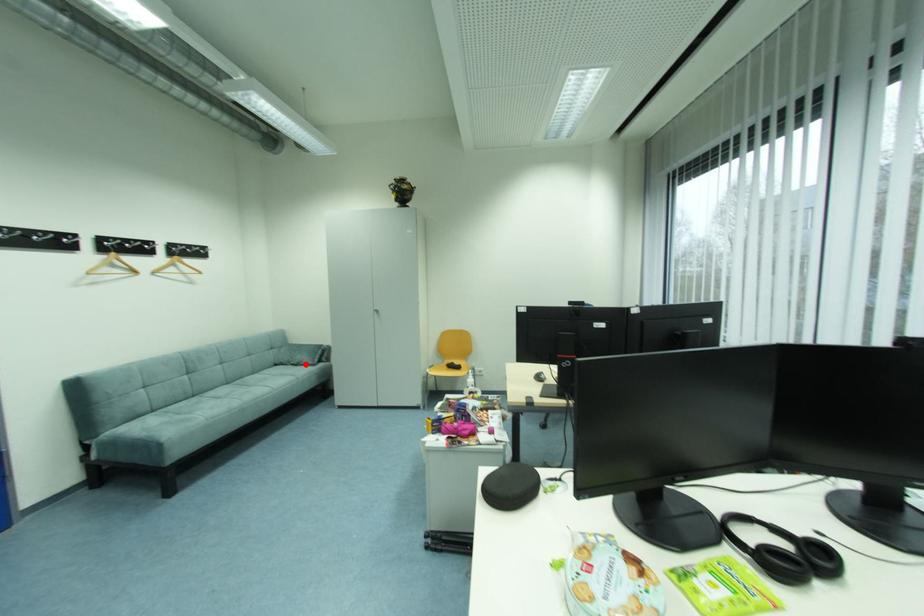
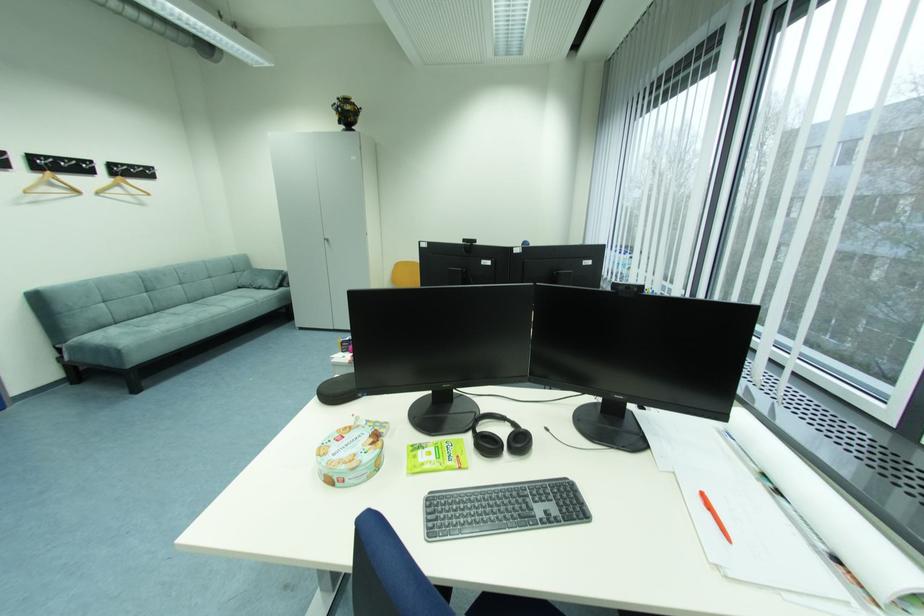
Question: A red point is marked in image1. In image2, is the corresponding 3D point closer to the camera or farther? Reply with the corresponding letter.

Choices:
 (A) The corresponding 3D point is closer.
 (B) The corresponding 3D point is farther.

Answer: (A)